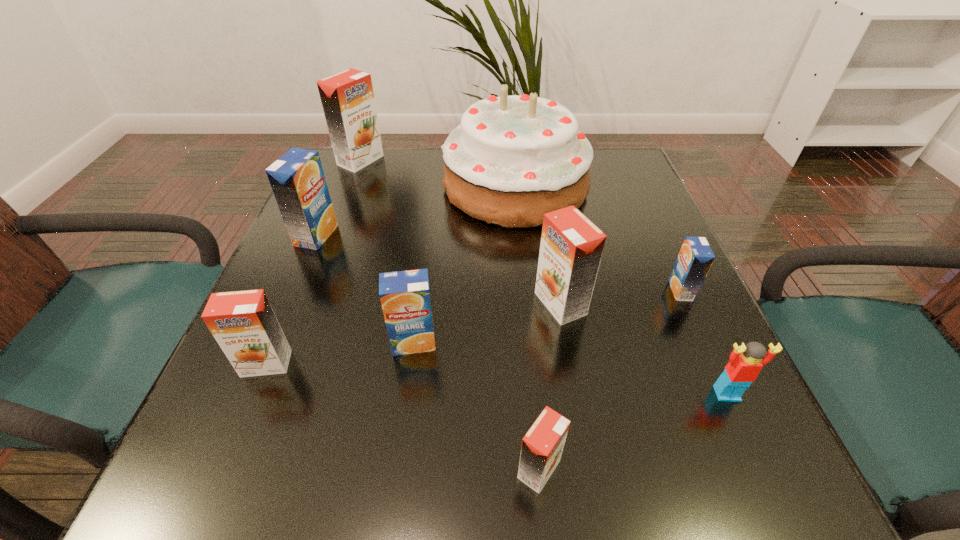
Where is `blank area located 0.240m on the left of the fourth orange juice from right to left`? blank area located 0.240m on the left of the fourth orange juice from right to left is located at coordinates (248, 342).

This screenshot has height=540, width=960. I want to click on vacant position located 0.080m on the face of the second nearest object, so click(x=755, y=455).

The width and height of the screenshot is (960, 540). Identify the location of free space located 0.210m on the left of the rightmost blue orange_juice. (560, 291).

Where is `vacant space situated on the left of the nearest orange juice`? This screenshot has height=540, width=960. vacant space situated on the left of the nearest orange juice is located at coordinates (322, 469).

At what (x,y) coordinates should I click in order to perform the action: click on cake located in the far edge section of the desktop. Please return your answer as a coordinate pair (x, y). Looking at the image, I should click on (512, 159).

At what (x,y) coordinates should I click in order to perform the action: click on orange juice at the far edge. Please return your answer as a coordinate pair (x, y). The image size is (960, 540). Looking at the image, I should click on (347, 98).

The image size is (960, 540). What are the coordinates of `object situated at the near edge` in the screenshot? It's located at (542, 446).

The height and width of the screenshot is (540, 960). Identify the location of cake located in the right edge section of the desktop. (512, 159).

This screenshot has height=540, width=960. I want to click on Lego that is at the right edge, so click(x=742, y=370).

The height and width of the screenshot is (540, 960). Find the location of `orange_juice present at the right edge`. orange_juice present at the right edge is located at coordinates (695, 258).